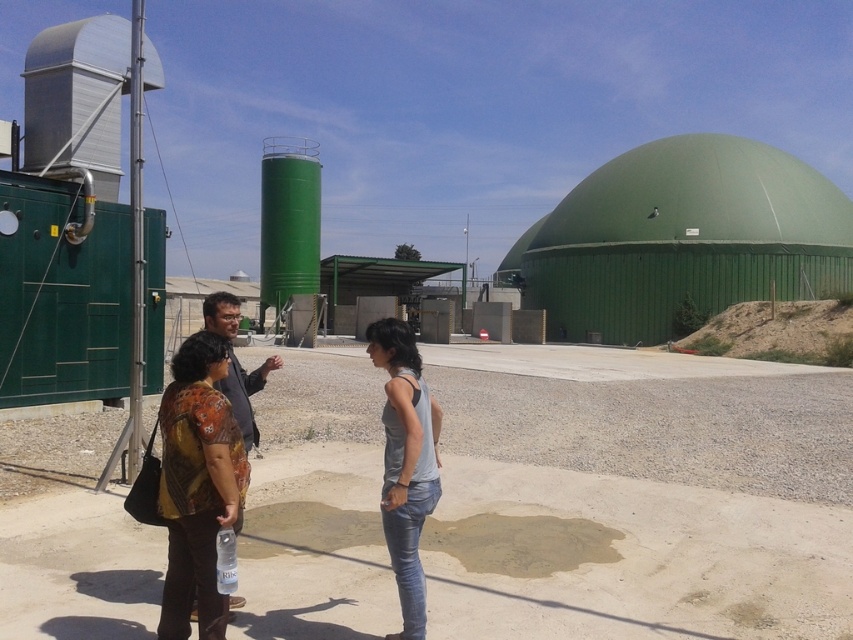
Question: Is printed fabric shirt at lower left bigger than gray matte tank top at center?

Choices:
 (A) yes
 (B) no

Answer: (B)

Question: Is printed fabric shirt at lower left further to the viewer compared to matte black shirt at center?

Choices:
 (A) yes
 (B) no

Answer: (B)

Question: Based on their relative distances, which object is farther from the printed fabric shirt at center?

Choices:
 (A) matte black shirt at center
 (B) printed fabric shirt at lower left

Answer: (B)

Question: Can you confirm if gray matte tank top at center is positioned to the left of matte black shirt at center?

Choices:
 (A) no
 (B) yes

Answer: (A)

Question: Which point appears farthest from the camera in this image?

Choices:
 (A) (418, 612)
 (B) (236, 412)
 (C) (190, 419)
 (D) (363, 339)

Answer: (D)

Question: Among these objects, which one is farthest from the camera?

Choices:
 (A) printed fabric shirt at lower left
 (B) gray matte tank top at center
 (C) matte black shirt at center
 (D) printed fabric shirt at center

Answer: (D)